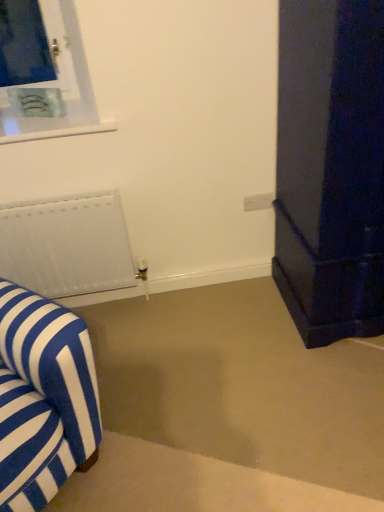
Question: Is blue and white striped fabric armchair at left outside white plastic electric outlet at center?

Choices:
 (A) yes
 (B) no

Answer: (A)

Question: Considering the relative sizes of blue and white striped fabric armchair at left and white plastic electric outlet at center in the image provided, is blue and white striped fabric armchair at left wider than white plastic electric outlet at center?

Choices:
 (A) no
 (B) yes

Answer: (B)

Question: Is blue and white striped fabric armchair at left not close to white plastic electric outlet at center?

Choices:
 (A) yes
 (B) no

Answer: (A)

Question: Does blue and white striped fabric armchair at left appear on the left side of white plastic electric outlet at center?

Choices:
 (A) no
 (B) yes

Answer: (B)

Question: From a real-world perspective, is blue and white striped fabric armchair at left located beneath white plastic electric outlet at center?

Choices:
 (A) yes
 (B) no

Answer: (A)

Question: Considering their positions, is white plastic electric outlet at center located in front of or behind blue and white striped fabric armchair at left?

Choices:
 (A) front
 (B) behind

Answer: (B)

Question: In terms of size, does white plastic electric outlet at center appear bigger or smaller than blue and white striped fabric armchair at left?

Choices:
 (A) big
 (B) small

Answer: (B)

Question: From a real-world perspective, is white plastic electric outlet at center positioned above or below blue and white striped fabric armchair at left?

Choices:
 (A) above
 (B) below

Answer: (A)

Question: Do you think white plastic electric outlet at center is within blue and white striped fabric armchair at left, or outside of it?

Choices:
 (A) inside
 (B) outside

Answer: (B)

Question: From their relative heights in the image, would you say white plastic electric outlet at center is taller or shorter than white matte radiator at left?

Choices:
 (A) short
 (B) tall

Answer: (A)

Question: Considering the positions of point coord(256,206) and point coord(3,230), is point coord(256,206) closer or farther from the camera than point coord(3,230)?

Choices:
 (A) closer
 (B) farther

Answer: (B)

Question: In the image, is white plastic electric outlet at center positioned in front of or behind white matte radiator at left?

Choices:
 (A) front
 (B) behind

Answer: (B)

Question: In terms of width, does white plastic electric outlet at center look wider or thinner when compared to white matte radiator at left?

Choices:
 (A) wide
 (B) thin

Answer: (B)

Question: Which is correct: blue and white striped fabric armchair at left is inside white plastic electric outlet at center, or outside of it?

Choices:
 (A) inside
 (B) outside

Answer: (B)

Question: In terms of size, does blue and white striped fabric armchair at left appear bigger or smaller than white plastic electric outlet at center?

Choices:
 (A) small
 (B) big

Answer: (B)